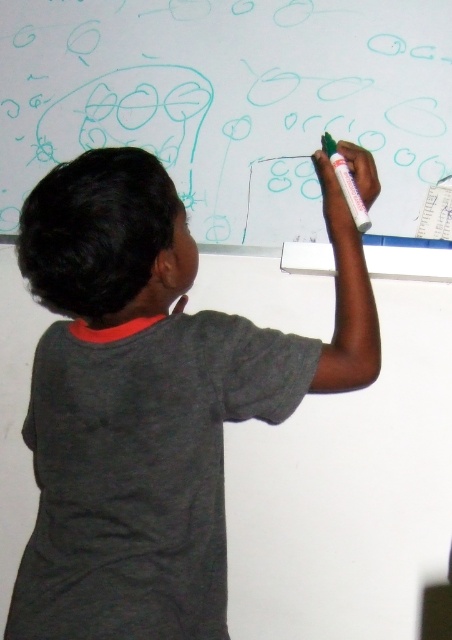
Who is lower down, dark gray t-shirt at upper center or whiteboard at upper center?

dark gray t-shirt at upper center

Which is behind, point (98, 637) or point (293, 19)?

The point (293, 19) is more distant.

Between point (136, 234) and point (326, 52), which one is positioned in front?

Positioned in front is point (136, 234).

Locate an element on the screen. The image size is (452, 640). dark gray t-shirt at upper center is located at coordinates (151, 397).

Who is higher up, whiteboard at upper center or green matte marker at upper center?

Positioned higher is whiteboard at upper center.

Is point (268, 195) less distant than point (343, 179)?

No, (268, 195) is behind (343, 179).

The image size is (452, 640). Identify the location of whiteboard at upper center. (230, 100).

Who is more distant from viewer, (x=128, y=333) or (x=357, y=225)?

Point (x=357, y=225)

At what (x,y) coordinates should I click in order to perform the action: click on dark gray t-shirt at upper center. Please return your answer as a coordinate pair (x, y). The image size is (452, 640). Looking at the image, I should click on (151, 397).